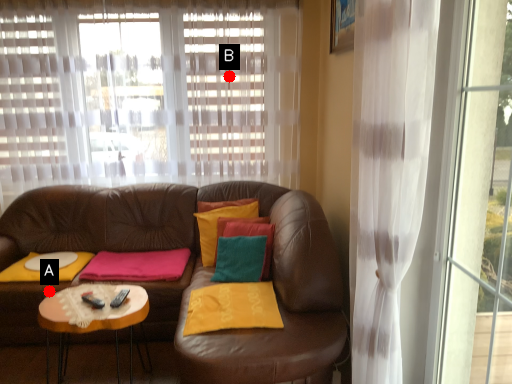
Question: Two points are circled on the image, labeled by A and B beside each circle. Among these points, which one is farthest from the camera?

Choices:
 (A) A is further
 (B) B is further

Answer: (B)